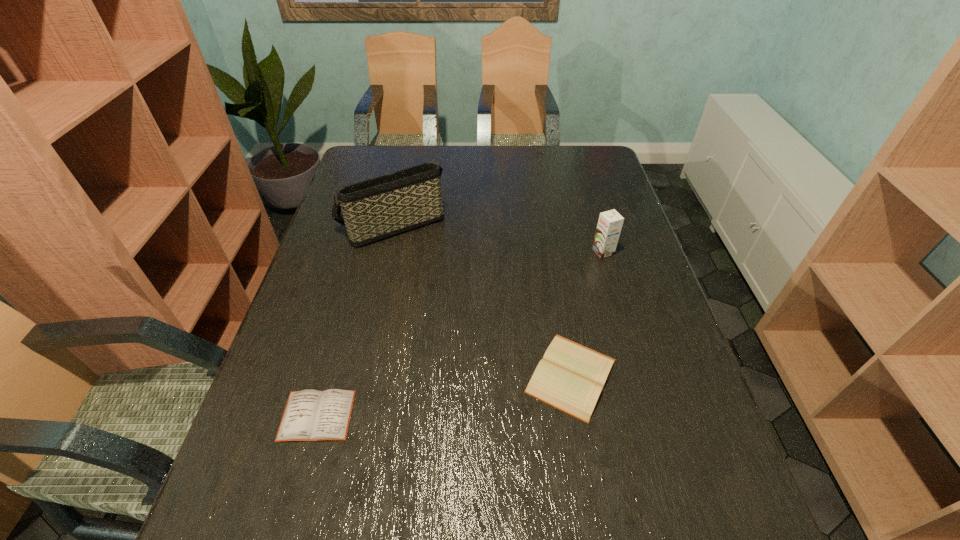
This screenshot has width=960, height=540. Identify the location of handbag. (374, 209).

Locate an element on the screen. This screenshot has height=540, width=960. chocolate milk is located at coordinates (610, 222).

Where is `the second tallest object`? Image resolution: width=960 pixels, height=540 pixels. the second tallest object is located at coordinates (610, 222).

Where is `the right diary`? This screenshot has width=960, height=540. the right diary is located at coordinates (571, 377).

The image size is (960, 540). Identify the location of the third tallest object. tap(571, 377).

I want to click on the left diary, so click(x=310, y=415).

Where is `the shortest object`? the shortest object is located at coordinates (310, 415).

Locate an element on the screen. This screenshot has height=540, width=960. free space located on the front of the handbag is located at coordinates (367, 335).

At what (x,y) coordinates should I click in order to perform the action: click on free space located 0.250m on the left of the rightmost object. Please return your answer as a coordinate pair (x, y). Image resolution: width=960 pixels, height=540 pixels. Looking at the image, I should click on (505, 252).

Where is `free space located 0.280m on the left of the second object from right to left`? free space located 0.280m on the left of the second object from right to left is located at coordinates (396, 376).